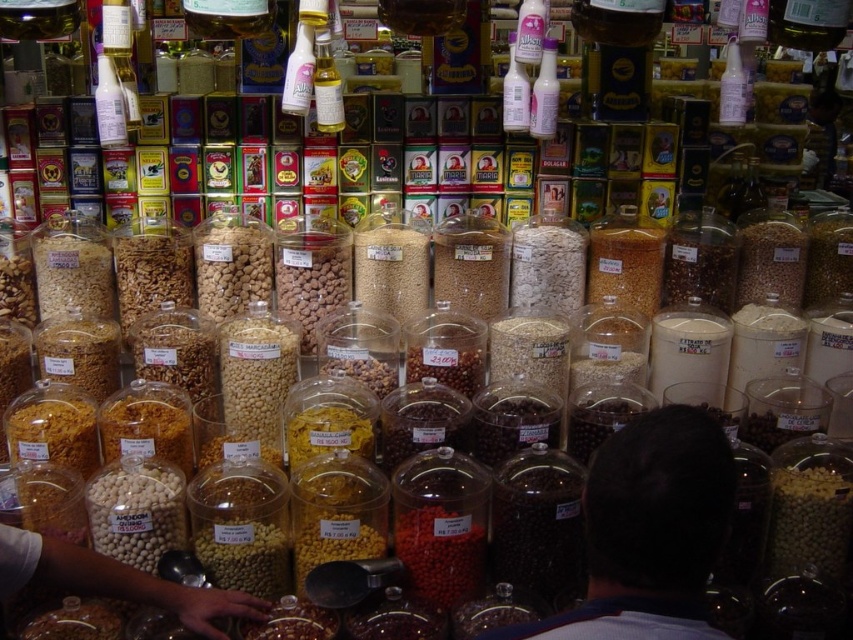
Consider the image. You are a customer at the market stall and want to buy both the dark brown hair at center and the translucent plastic bottle at center. Which one of these items has a larger physical size?

The dark brown hair at center is bigger than the translucent plastic bottle at center, so the dark brown hair at center has a larger physical size.

You are standing in front of the market stall and want to reach both points mentioned. Which point, point (637, 602) or point (329, 54), will you reach first?

Point (637, 602) is closer to the viewer than point (329, 54), so you will reach point (637, 602) first.

You are a customer at the market stall looking at the dark brown hair at center and the translucent plastic bottle at center. Which object is positioned higher in the scene?

The translucent plastic bottle at center is positioned higher than the dark brown hair at center because the dark brown hair at center is below it.